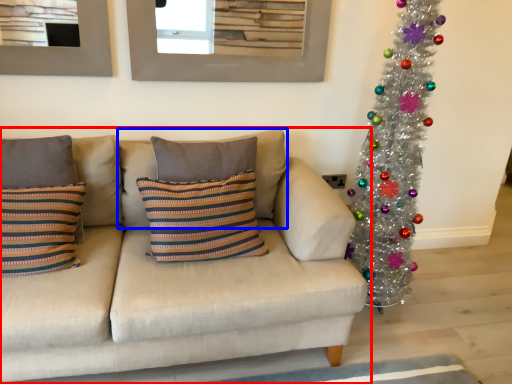
Question: Among these objects, which one is farthest to the camera, studio couch (highlighted by a red box) or pillow (highlighted by a blue box)?

Choices:
 (A) studio couch
 (B) pillow

Answer: (B)